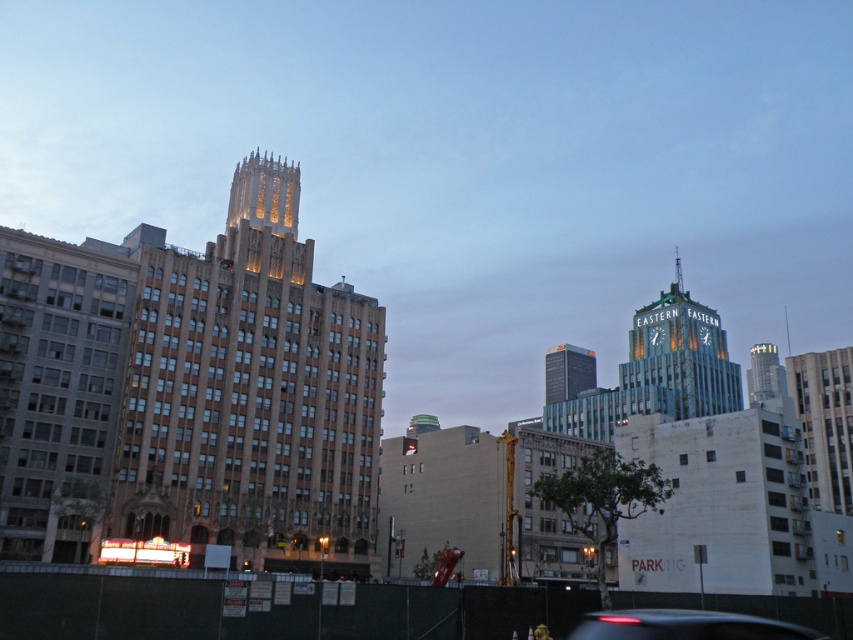
You are a pedestrian standing at the edge of the construction area enclosed by the dark green fence. You want to cross the street to reach the green glass skyscraper at center. Which direction should you walk relative to the black glossy car at lower center?

You should walk to the right of the black glossy car at lower center because the green glass skyscraper at center is located to the right of the black glossy car at lower center.

You are an architect analyzing the urban skyline. Given the scene described, which of the two skyscrapers, the green glass skyscraper at center or the glass skyscraper at upper right, is shorter?

The green glass skyscraper at center is shorter than the glass skyscraper at upper right.

Based on the photo, based on the scene description, which object is taller between the black glossy car at lower center and the green glass skyscraper at center?

The green glass skyscraper at center is taller than the black glossy car at lower center.